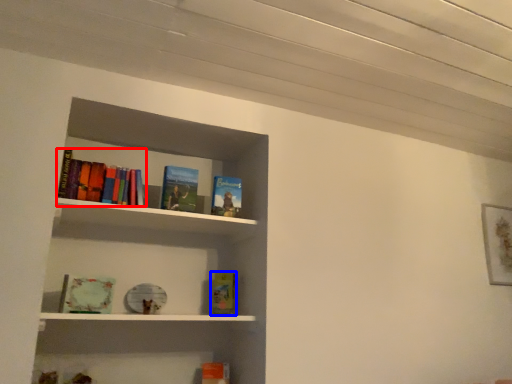
Question: Among these objects, which one is nearest to the camera, book (highlighted by a red box) or book (highlighted by a blue box)?

Choices:
 (A) book
 (B) book

Answer: (A)